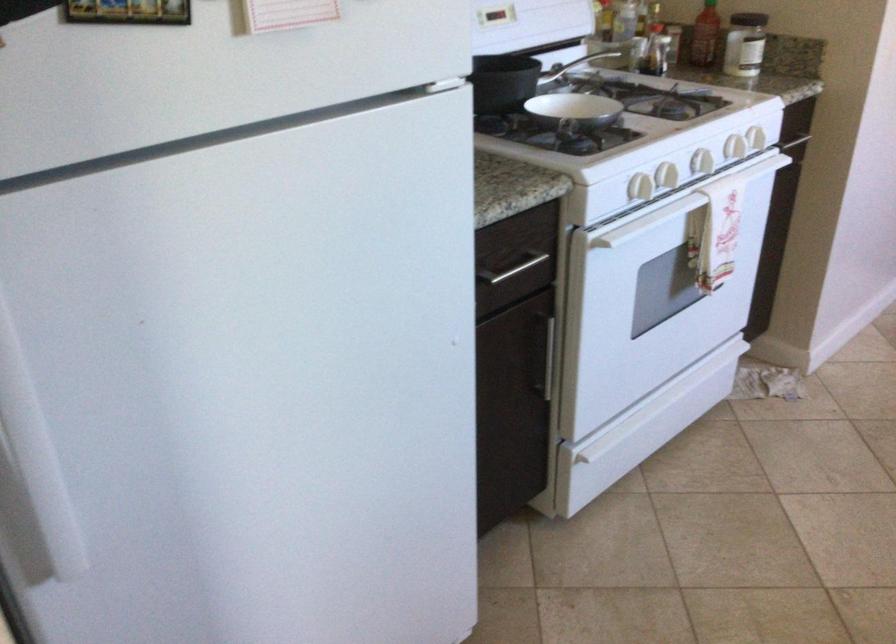
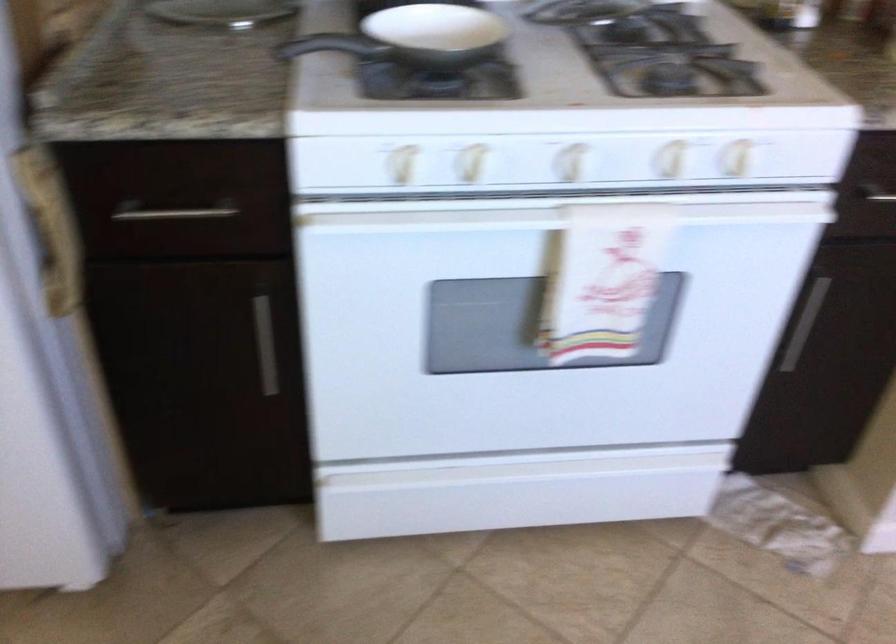
The point at [735,111] is marked in the first image. Where is the corresponding point in the second image?

(670, 158)